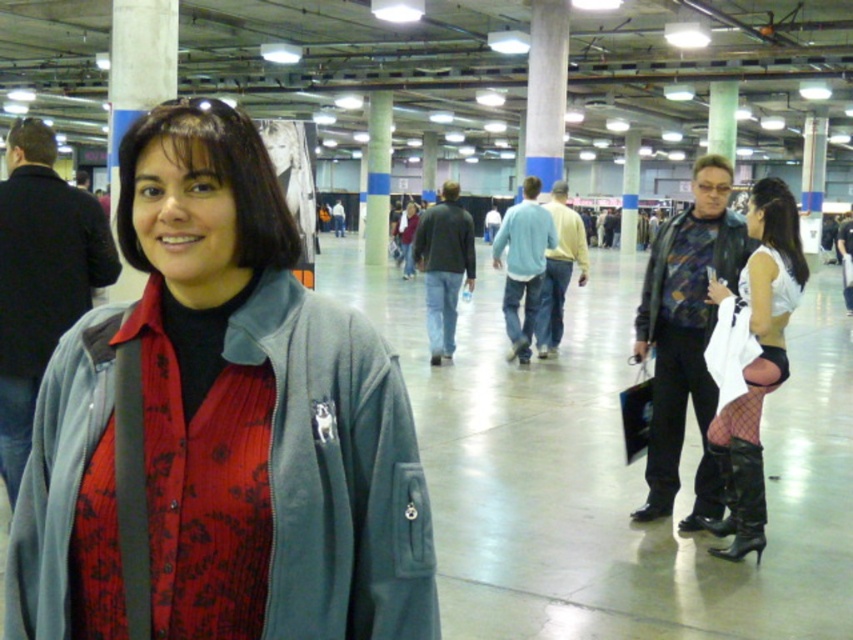
Does matte gray jacket at left have a smaller size compared to printed fabric jacket at right?

Actually, matte gray jacket at left might be larger than printed fabric jacket at right.

Between matte gray jacket at left and printed fabric jacket at right, which one appears on the right side from the viewer's perspective?

printed fabric jacket at right is more to the right.

The height and width of the screenshot is (640, 853). I want to click on matte gray jacket at left, so click(45, 264).

This screenshot has width=853, height=640. I want to click on matte gray jacket at left, so click(45, 264).

Is matte gray jacket at center thinner than black leather boot at lower right?

No.

Does point (233, 276) come in front of point (721, 472)?

Yes, point (233, 276) is in front of point (721, 472).

This screenshot has width=853, height=640. I want to click on matte gray jacket at center, so click(x=218, y=428).

Which is above, black leather boot at lower right or light blue fleece jacket at center?

light blue fleece jacket at center is higher up.

Does point (756, 544) come closer to viewer compared to point (514, 276)?

Yes, point (756, 544) is in front of point (514, 276).

Is point (722, 452) closer to viewer compared to point (535, 225)?

Yes, it is.

I want to click on black leather boot at lower right, so click(740, 499).